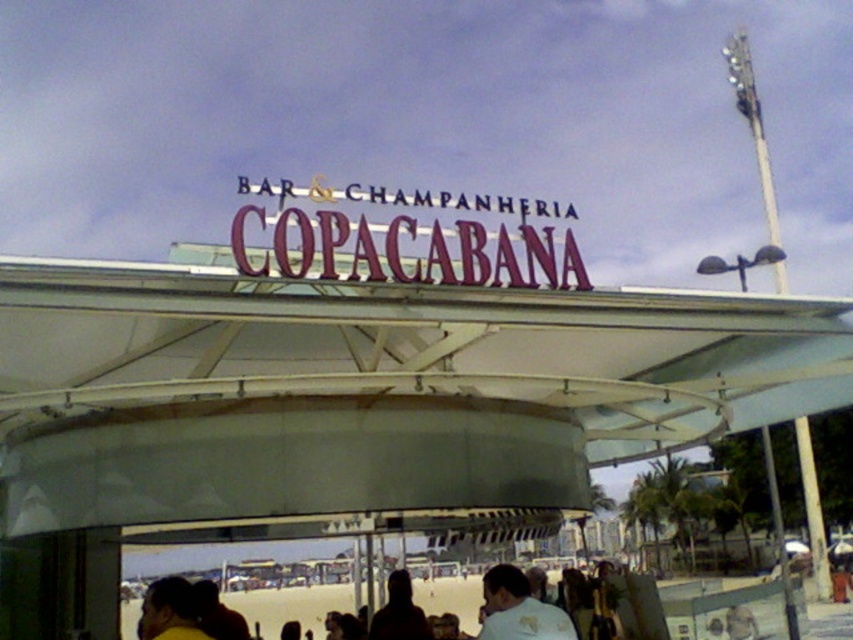
You are a customer standing in front of the Copacabana bar and champagne house. You see the white matte canopy at center and the metallic purple sign at center. Which object is located to the left of the other?

The metallic purple sign at center is to the left of the white matte canopy at center.

In the scene shown: You are standing at the entrance of the Copacabana bar and champagne house. You see two points marked on the ground. The first point is at coordinate point (430, 237) and the second point is at coordinate point (399, 634). If you want to walk towards the back of the building, which point should you avoid stepping on?

You should avoid stepping on point (430, 237) because it is in front of point (399, 634), meaning it is closer to the entrance and not towards the back of the building.